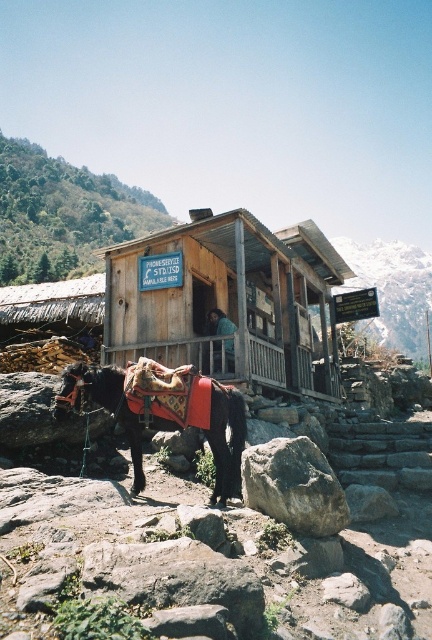
Is wooden hut at center in front of smooth wooden door at center?

Yes, it is.

Is point (260, 336) closer to camera compared to point (228, 339)?

No, (260, 336) is further to viewer.

This screenshot has height=640, width=432. What are the coordinates of `wooden hut at center` in the screenshot? It's located at (225, 298).

This screenshot has width=432, height=640. Identify the location of wooden hut at center. (225, 298).

The height and width of the screenshot is (640, 432). What do you see at coordinates (219, 550) in the screenshot?
I see `smooth gray rock at lower center` at bounding box center [219, 550].

Between point (406, 500) and point (213, 355), which one is positioned behind?

Point (213, 355)

The width and height of the screenshot is (432, 640). What do you see at coordinates (219, 550) in the screenshot?
I see `smooth gray rock at lower center` at bounding box center [219, 550].

Identify the location of smooth gray rock at lower center. The image size is (432, 640). (219, 550).

Who is higher up, shiny brown horse at lower left or gray rough rock at lower center?

shiny brown horse at lower left is above.

Does shiny brown horse at lower left appear on the right side of gray rough rock at lower center?

No, shiny brown horse at lower left is not to the right of gray rough rock at lower center.

Image resolution: width=432 pixels, height=640 pixels. I want to click on shiny brown horse at lower left, so click(x=164, y=410).